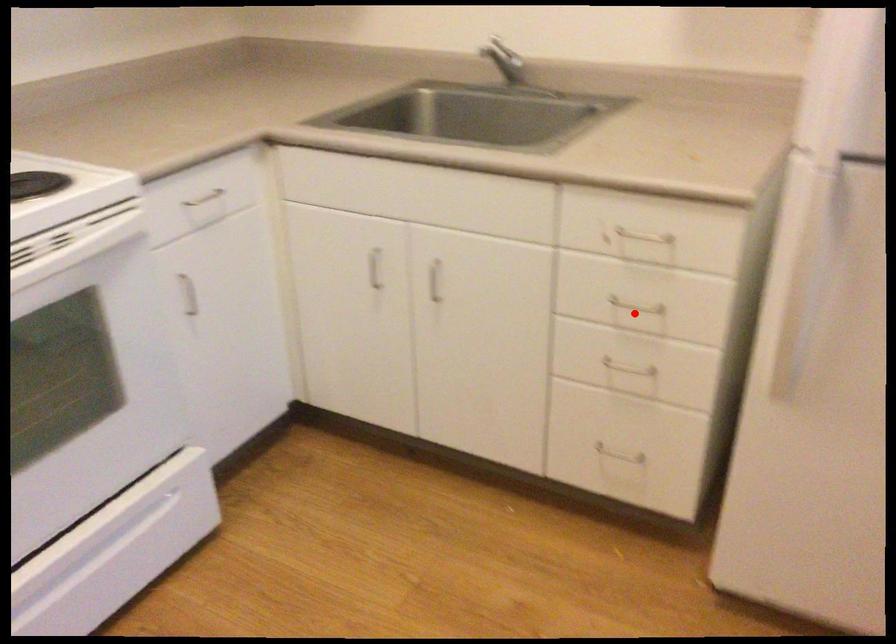
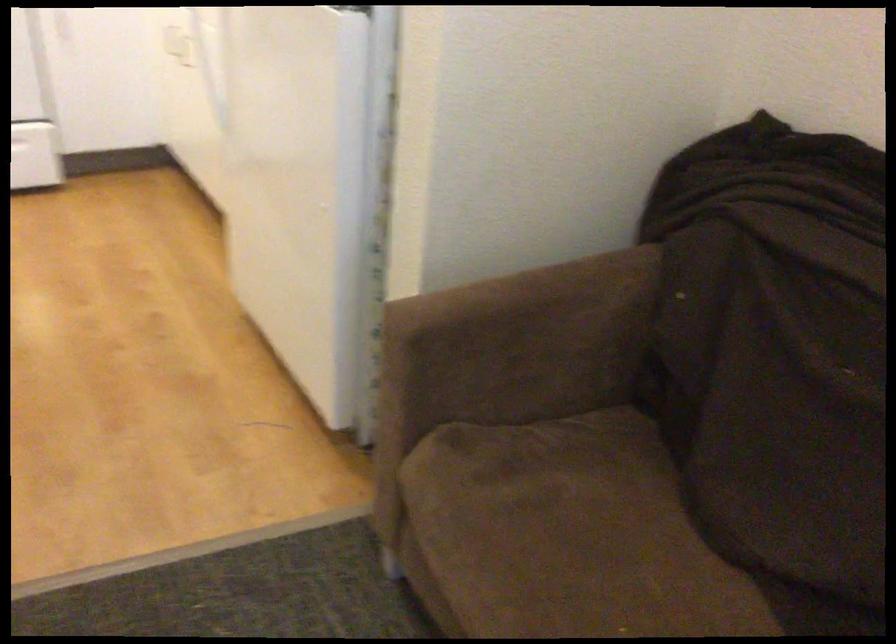
Question: I am providing you with two images of the same scene from different viewpoints. A red point is marked on the first image. Is the red point's position out of view in image 2?

Choices:
 (A) Yes
 (B) No

Answer: (A)